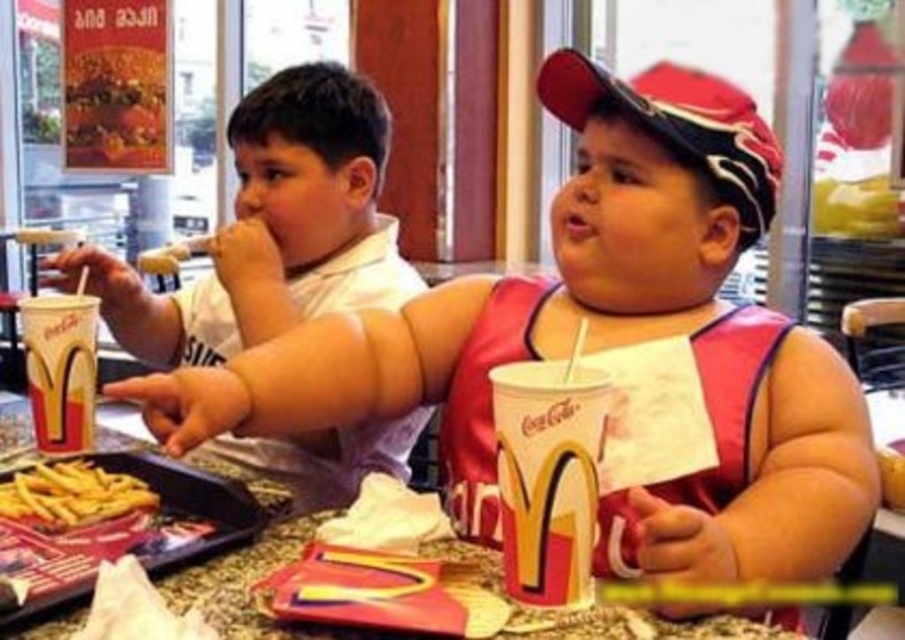
You are a McDonalds employee and you need to place a new menu board on the table. The menu board is 10 cm wide. There is a white matte shirt at upper left and a matte paper cup at lower left on the table. Can the menu board fit between them?

The white matte shirt at upper left might be wider than matte paper cup at lower left, so the menu board may not fit between them because the shirt is wider than the cup. The available space between them could be less than 10 cm. Please check the actual width.

You are a parent trying to decide which item to grab first for your child. The matte paper cup at center contains a drink, and the yellow crispy french fries at lower left are the snack. Considering their heights, which item is taller?

The matte paper cup at center is taller than the yellow crispy french fries at lower left according to the description.

You are a parent at McDonalds with a child who wants to reach their matte paper cup at center from the yellow crispy french fries at lower left. Can the child easily reach the cup without moving the fries?

The distance between the matte paper cup at center and the yellow crispy french fries at lower left is 20.16 inches, which is relatively far for a child to reach without moving the fries. The child may need to adjust their position or move the fries closer to comfortably reach the cup.